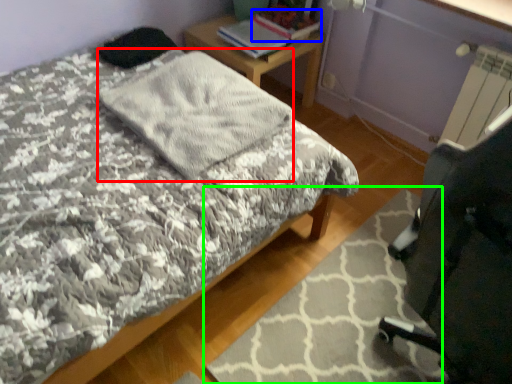
Question: Which object is positioned closest to blanket (highlighted by a red box)? Select from book (highlighted by a blue box) and mat (highlighted by a green box).

Choices:
 (A) book
 (B) mat

Answer: (B)